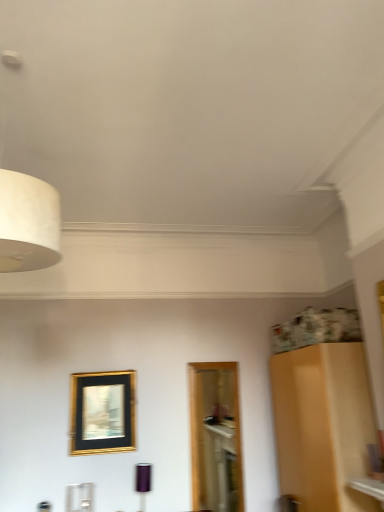
Where is `gold/black/glass picture frame at center`? Image resolution: width=384 pixels, height=512 pixels. gold/black/glass picture frame at center is located at coordinates (103, 413).

You are a GUI agent. You are given a task and a screenshot of the screen. Output one action in this format:
    pyautogui.click(x=<x>, y=<y>)
    Task: Click on the white matte lampshade at upper left, positioned as the 2th lamp in bottom-to-top order
    The image size is (384, 512).
    Given the screenshot: What is the action you would take?
    pyautogui.click(x=28, y=223)

Would you say gold/black/glass picture frame at center is to the left or to the right of white matte lampshade at upper left, the 2th lamp positioned from the right, in the picture?

gold/black/glass picture frame at center is to the right of white matte lampshade at upper left, the 2th lamp positioned from the right.

Is point (80, 403) less distant than point (52, 193)?

No, (80, 403) is further to viewer.

From a real-world perspective, is gold/black/glass picture frame at center positioned over white matte lampshade at upper left, which appears as the first lamp when viewed from the left, based on gravity?

Actually, gold/black/glass picture frame at center is physically below white matte lampshade at upper left, which appears as the first lamp when viewed from the left, in the real world.

Considering the sizes of objects white matte lampshade at upper left, placed as the 1th lamp when sorted from front to back, and gold/black/glass picture frame at center in the image provided, who is smaller, white matte lampshade at upper left, placed as the 1th lamp when sorted from front to back, or gold/black/glass picture frame at center?

Smaller between the two is gold/black/glass picture frame at center.

From a real-world perspective, relative to gold/black/glass picture frame at center, is white matte lampshade at upper left, which is the 1th lamp in top-to-bottom order, vertically above or below?

In terms of real-world spatial position, white matte lampshade at upper left, which is the 1th lamp in top-to-bottom order, is above gold/black/glass picture frame at center.

Which is in front, point (37, 244) or point (135, 373)?

The point (37, 244) is closer to the camera.

Who is smaller, matte black lampshade at lower center, placed as the first lamp when sorted from right to left, or white matte lampshade at upper left, placed as the 1th lamp when sorted from front to back?

With smaller size is matte black lampshade at lower center, placed as the first lamp when sorted from right to left.

Would you say matte black lampshade at lower center, which is counted as the second lamp, starting from the front, is inside or outside white matte lampshade at upper left, the second lamp when ordered from back to front?

matte black lampshade at lower center, which is counted as the second lamp, starting from the front, lies outside white matte lampshade at upper left, the second lamp when ordered from back to front.

Which is farther, (141,479) or (41,238)?

The point (141,479) is farther.

From a real-world perspective, does matte black lampshade at lower center, which is counted as the second lamp, starting from the front, stand above white matte lampshade at upper left, the second lamp when ordered from back to front?

No, from a real-world perspective, matte black lampshade at lower center, which is counted as the second lamp, starting from the front, is not above white matte lampshade at upper left, the second lamp when ordered from back to front.

From the image's perspective, which is below, gold/black/glass picture frame at center or matte black lampshade at lower center, which appears as the first lamp when viewed from the back?

matte black lampshade at lower center, which appears as the first lamp when viewed from the back.

Between gold/black/glass picture frame at center and matte black lampshade at lower center, which ranks as the 2th lamp in top-to-bottom order, which one has less height?

Standing shorter between the two is matte black lampshade at lower center, which ranks as the 2th lamp in top-to-bottom order.

Which is behind, point (118, 412) or point (140, 493)?

The point (118, 412) is behind.

Could you tell me if gold/black/glass picture frame at center is facing matte black lampshade at lower center, positioned as the first lamp in bottom-to-top order?

No, gold/black/glass picture frame at center is not oriented towards matte black lampshade at lower center, positioned as the first lamp in bottom-to-top order.

Is matte black lampshade at lower center, placed as the first lamp when sorted from right to left, oriented towards gold/black/glass picture frame at center?

No, matte black lampshade at lower center, placed as the first lamp when sorted from right to left, is not oriented towards gold/black/glass picture frame at center.

Considering the positions of objects matte black lampshade at lower center, which is counted as the 2th lamp, starting from the left, and gold/black/glass picture frame at center in the image provided, who is more to the left, matte black lampshade at lower center, which is counted as the 2th lamp, starting from the left, or gold/black/glass picture frame at center?

gold/black/glass picture frame at center is more to the left.

How far apart are matte black lampshade at lower center, placed as the first lamp when sorted from right to left, and gold/black/glass picture frame at center?

19.52 inches.

Is white matte lampshade at upper left, which is the 1th lamp in top-to-bottom order, not within matte black lampshade at lower center, which ranks as the 2th lamp in top-to-bottom order?

Yes.

Identify the location of lamp in front of the matte black lampshade at lower center, which ranks as the 2th lamp in top-to-bottom order. (28, 223).

Looking at this image, from the image's perspective, relative to matte black lampshade at lower center, placed as the first lamp when sorted from right to left, is white matte lampshade at upper left, the 2th lamp positioned from the right, above or below?

white matte lampshade at upper left, the 2th lamp positioned from the right, is situated higher than matte black lampshade at lower center, placed as the first lamp when sorted from right to left, in the image.

This screenshot has width=384, height=512. Identify the location of picture frame below the white matte lampshade at upper left, the 2th lamp positioned from the right (from a real-world perspective). (103, 413).

The height and width of the screenshot is (512, 384). Identify the location of picture frame on the right of white matte lampshade at upper left, which is the 1th lamp in top-to-bottom order. (103, 413).

Based on their spatial positions, is matte black lampshade at lower center, placed as the first lamp when sorted from right to left, or gold/black/glass picture frame at center closer to white matte lampshade at upper left, the 2th lamp positioned from the right?

Based on the image, gold/black/glass picture frame at center appears to be nearer to white matte lampshade at upper left, the 2th lamp positioned from the right.

Based on their spatial positions, is white matte lampshade at upper left, the 2th lamp positioned from the right, or matte black lampshade at lower center, which appears as the first lamp when viewed from the back, closer to gold/black/glass picture frame at center?

matte black lampshade at lower center, which appears as the first lamp when viewed from the back, is closer to gold/black/glass picture frame at center.

Which object lies nearer to the anchor point matte black lampshade at lower center, which is counted as the second lamp, starting from the front, white matte lampshade at upper left, which appears as the first lamp when viewed from the left, or gold/black/glass picture frame at center?

gold/black/glass picture frame at center.

Looking at the image, which one is located further to matte black lampshade at lower center, placed as the first lamp when sorted from right to left, gold/black/glass picture frame at center or white matte lampshade at upper left, placed as the 1th lamp when sorted from front to back?

white matte lampshade at upper left, placed as the 1th lamp when sorted from front to back, is positioned further to the anchor matte black lampshade at lower center, placed as the first lamp when sorted from right to left.

Looking at the image, which one is located further to gold/black/glass picture frame at center, matte black lampshade at lower center, which is counted as the second lamp, starting from the front, or white matte lampshade at upper left, which is the 1th lamp in top-to-bottom order?

white matte lampshade at upper left, which is the 1th lamp in top-to-bottom order, is further to gold/black/glass picture frame at center.

Looking at the image, which one is located further to white matte lampshade at upper left, the 2th lamp positioned from the right, gold/black/glass picture frame at center or matte black lampshade at lower center, which ranks as the 2th lamp in top-to-bottom order?

The object further to white matte lampshade at upper left, the 2th lamp positioned from the right, is matte black lampshade at lower center, which ranks as the 2th lamp in top-to-bottom order.

Locate an element on the screen. picture frame between white matte lampshade at upper left, placed as the 1th lamp when sorted from front to back, and matte black lampshade at lower center, which appears as the first lamp when viewed from the back, vertically is located at coordinates (103, 413).